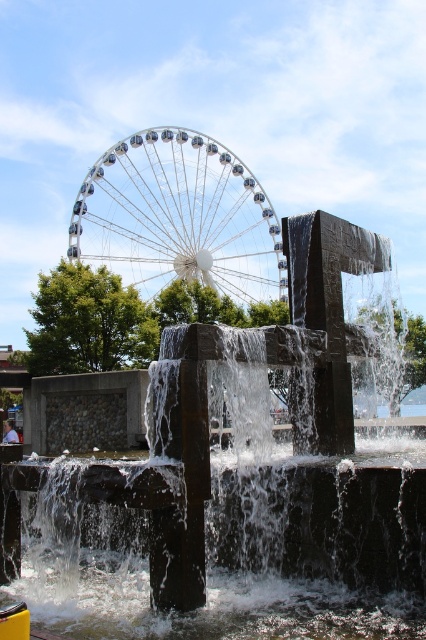
Question: In this image, where is clear water at center located relative to shiny metallic ferris wheel at upper center?

Choices:
 (A) left
 (B) right

Answer: (B)

Question: Is clear water at center further to camera compared to shiny metallic ferris wheel at upper center?

Choices:
 (A) yes
 (B) no

Answer: (B)

Question: Among these objects, which one is nearest to the camera?

Choices:
 (A) shiny metallic ferris wheel at upper center
 (B) clear water at center

Answer: (B)

Question: From the image, what is the correct spatial relationship of clear water at center in relation to shiny metallic ferris wheel at upper center?

Choices:
 (A) above
 (B) below

Answer: (B)

Question: Among these objects, which one is nearest to the camera?

Choices:
 (A) clear water at center
 (B) shiny metallic ferris wheel at upper center

Answer: (A)